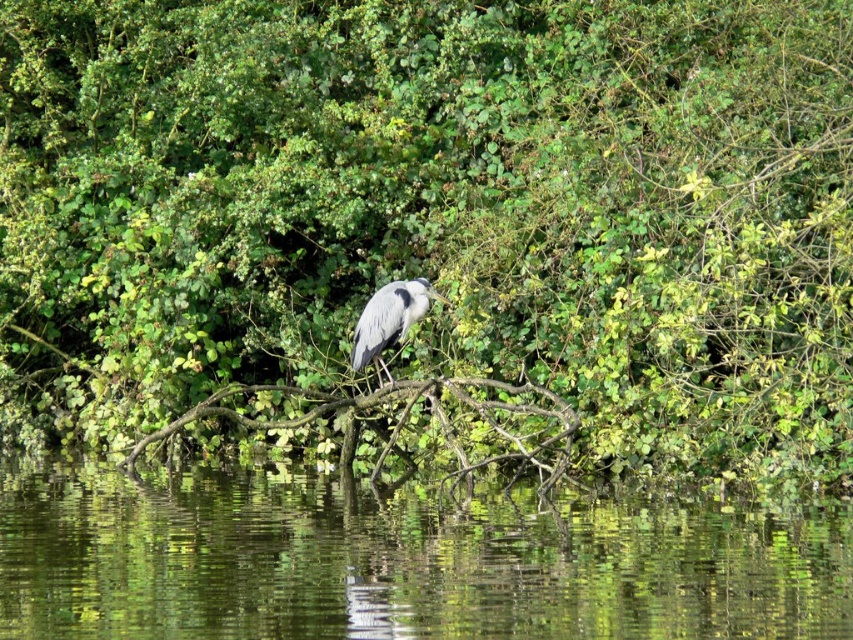
Who is more distant from viewer, (x=360, y=404) or (x=379, y=384)?

Positioned behind is point (x=360, y=404).

Can you confirm if brown rough tree branch at center is positioned to the right of gray matte heron at center?

Indeed, brown rough tree branch at center is positioned on the right side of gray matte heron at center.

At what (x,y) coordinates should I click in order to perform the action: click on brown rough tree branch at center. Please return your answer as a coordinate pair (x, y). The image size is (853, 640). Looking at the image, I should click on (433, 416).

Is the position of transparent water at center less distant than that of gray matte heron at center?

Yes, transparent water at center is in front of gray matte heron at center.

Can you confirm if transparent water at center is positioned below gray matte heron at center?

Yes.

Locate an element on the screen. transparent water at center is located at coordinates (399, 561).

Between transparent water at center and brown rough tree branch at center, which one has more height?

brown rough tree branch at center is taller.

How distant is transparent water at center from brown rough tree branch at center?

transparent water at center is 4.57 feet away from brown rough tree branch at center.

Between point (813, 506) and point (503, 428), which one is positioned behind?

Positioned behind is point (503, 428).

Find the location of a particular element. The height and width of the screenshot is (640, 853). transparent water at center is located at coordinates (399, 561).